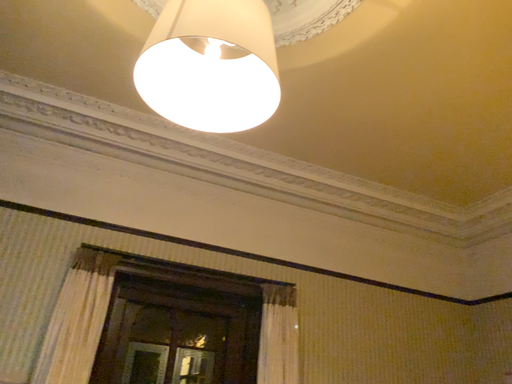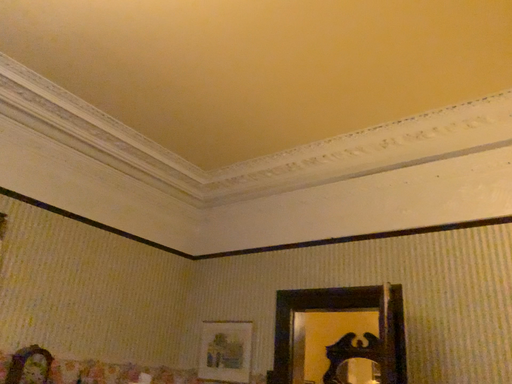
Question: How did the camera likely rotate when shooting the video?

Choices:
 (A) rotated downward
 (B) rotated upward

Answer: (A)